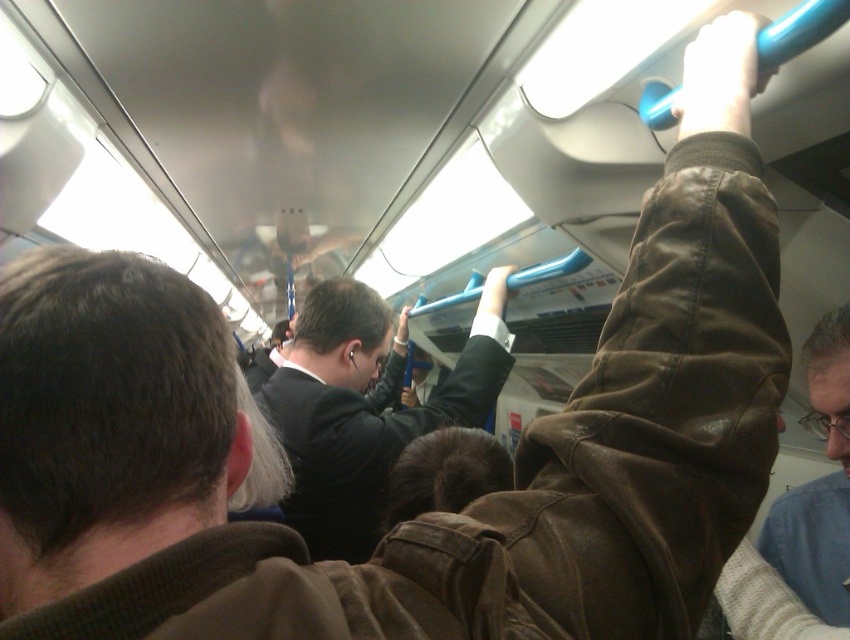
Which is above, black suit at center or light brown leather jacket at upper right?

black suit at center is higher up.

Consider the image. Is black suit at center to the right of light brown leather jacket at upper right from the viewer's perspective?

Incorrect, black suit at center is not on the right side of light brown leather jacket at upper right.

Who is more distant from viewer, (353, 474) or (843, 618)?

Point (353, 474)

At what (x,y) coordinates should I click in order to perform the action: click on black suit at center. Please return your answer as a coordinate pair (x, y). Image resolution: width=850 pixels, height=640 pixels. Looking at the image, I should click on (366, 408).